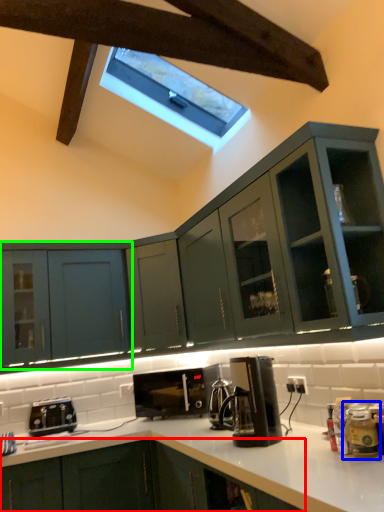
Question: Which object is the closest to the cabinetry (highlighted by a red box)? Choose among these: appliance (highlighted by a blue box) or cabinetry (highlighted by a green box).

Choices:
 (A) appliance
 (B) cabinetry

Answer: (B)